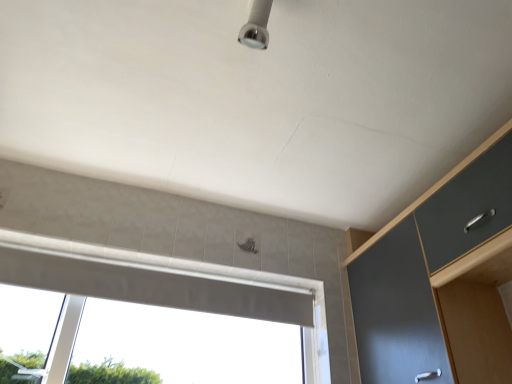
Question: Considering the relative positions of matte gray cabinet at right and white glossy window at center in the image provided, is matte gray cabinet at right to the left of white glossy window at center from the viewer's perspective?

Choices:
 (A) no
 (B) yes

Answer: (A)

Question: Are matte gray cabinet at right and white glossy window at center making contact?

Choices:
 (A) yes
 (B) no

Answer: (B)

Question: Is the position of matte gray cabinet at right less distant than that of white glossy window at center?

Choices:
 (A) no
 (B) yes

Answer: (B)

Question: Does matte gray cabinet at right have a smaller size compared to white glossy window at center?

Choices:
 (A) yes
 (B) no

Answer: (B)

Question: From a real-world perspective, is matte gray cabinet at right located beneath white glossy window at center?

Choices:
 (A) no
 (B) yes

Answer: (A)

Question: Is matte gray cabinet at right positioned behind white glossy window at center?

Choices:
 (A) yes
 (B) no

Answer: (B)

Question: Is white glossy window at center at the left side of matte gray cabinet at right?

Choices:
 (A) no
 (B) yes

Answer: (B)

Question: From the image's perspective, is white glossy window at center on top of matte gray cabinet at right?

Choices:
 (A) no
 (B) yes

Answer: (A)

Question: Is the position of white glossy window at center more distant than that of matte gray cabinet at right?

Choices:
 (A) no
 (B) yes

Answer: (B)

Question: Is white glossy window at center at the right side of matte gray cabinet at right?

Choices:
 (A) yes
 (B) no

Answer: (B)

Question: Is white glossy window at center turned away from matte gray cabinet at right?

Choices:
 (A) yes
 (B) no

Answer: (B)

Question: Can you confirm if white glossy window at center is wider than matte gray cabinet at right?

Choices:
 (A) yes
 (B) no

Answer: (B)

Question: Do you think white glossy window at center is within matte gray cabinet at right, or outside of it?

Choices:
 (A) outside
 (B) inside

Answer: (A)